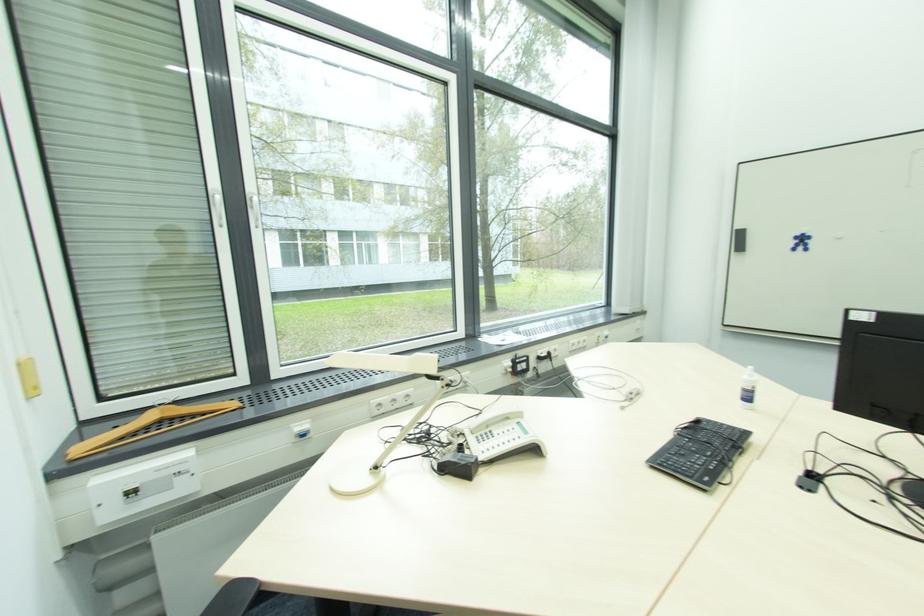
This screenshot has width=924, height=616. Describe the element at coordinates (31, 385) in the screenshot. I see `a yellow light switch` at that location.